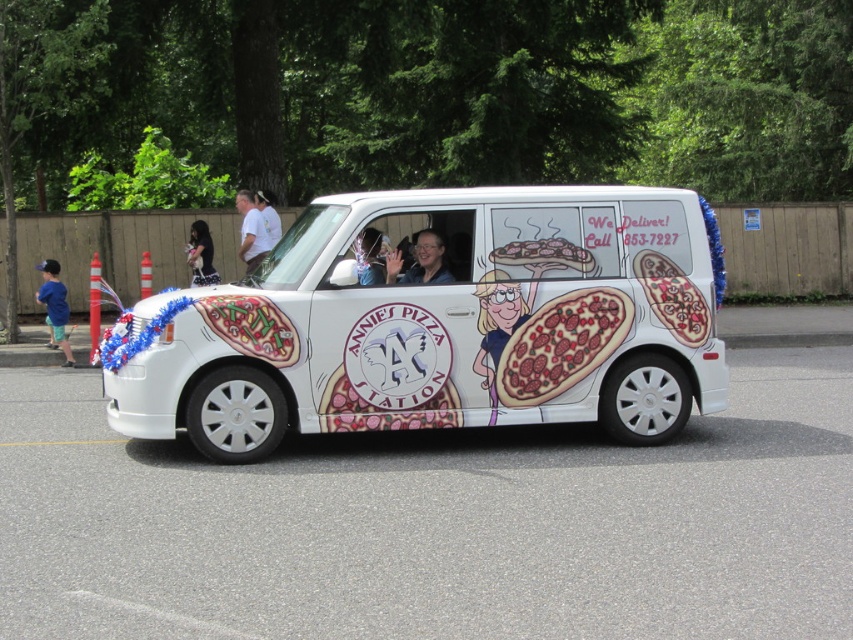
The width and height of the screenshot is (853, 640). What are the coordinates of `cartoon pizza at center` in the screenshot? It's located at (561, 344).

Between point (566, 353) and point (492, 404), which one is positioned behind?

The point (566, 353) is behind.

This screenshot has width=853, height=640. Identify the location of cartoon pizza at center. (561, 344).

Can you confirm if cartoon pizza at center is positioned to the right of white t-shirt at center?

Yes, cartoon pizza at center is to the right of white t-shirt at center.

Is cartoon pizza at center shorter than white t-shirt at center?

Correct, cartoon pizza at center is not as tall as white t-shirt at center.

Describe the element at coordinates (561, 344) in the screenshot. I see `cartoon pizza at center` at that location.

Identify the location of cartoon pizza at center. The image size is (853, 640). (561, 344).

Is white t-shirt at center bigger than dark hair at center?

Correct, white t-shirt at center is larger in size than dark hair at center.

Is point (248, 236) positioned after point (194, 246)?

That is False.

Find the location of `white t-shirt at center`. white t-shirt at center is located at coordinates (251, 230).